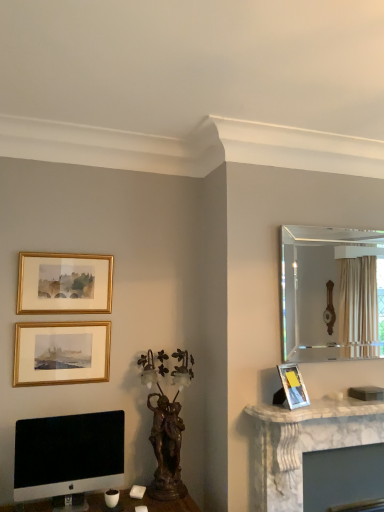
Question: Is clear glass mirror at upper right taller than matte silver picture frame at right, arranged as the third picture frame when viewed from the top?

Choices:
 (A) yes
 (B) no

Answer: (A)

Question: Is clear glass mirror at upper right to the left of matte silver picture frame at right, the 1th picture frame in the bottom-to-top sequence, from the viewer's perspective?

Choices:
 (A) no
 (B) yes

Answer: (A)

Question: Is clear glass mirror at upper right wider than matte silver picture frame at right, the 1th picture frame in the bottom-to-top sequence?

Choices:
 (A) no
 (B) yes

Answer: (A)

Question: From the image's perspective, is clear glass mirror at upper right above matte silver picture frame at right, arranged as the third picture frame when viewed from the top?

Choices:
 (A) yes
 (B) no

Answer: (A)

Question: From a real-world perspective, is clear glass mirror at upper right over matte silver picture frame at right, the 1th picture frame viewed from the right?

Choices:
 (A) no
 (B) yes

Answer: (B)

Question: From a real-world perspective, does clear glass mirror at upper right sit lower than matte silver picture frame at right, the 1th picture frame viewed from the right?

Choices:
 (A) no
 (B) yes

Answer: (A)

Question: Is bronze/bronzed sculpture at center in front of sleek silver monitor at lower left?

Choices:
 (A) yes
 (B) no

Answer: (B)

Question: Is bronze/bronzed sculpture at center shorter than sleek silver monitor at lower left?

Choices:
 (A) no
 (B) yes

Answer: (A)

Question: Does bronze/bronzed sculpture at center appear on the right side of sleek silver monitor at lower left?

Choices:
 (A) yes
 (B) no

Answer: (A)

Question: From a real-world perspective, is bronze/bronzed sculpture at center beneath sleek silver monitor at lower left?

Choices:
 (A) no
 (B) yes

Answer: (A)

Question: Can you confirm if bronze/bronzed sculpture at center is smaller than sleek silver monitor at lower left?

Choices:
 (A) no
 (B) yes

Answer: (A)

Question: Is there a large distance between bronze/bronzed sculpture at center and sleek silver monitor at lower left?

Choices:
 (A) yes
 (B) no

Answer: (B)

Question: Can clear glass mirror at upper right be found inside white marble fireplace at right?

Choices:
 (A) yes
 (B) no

Answer: (B)